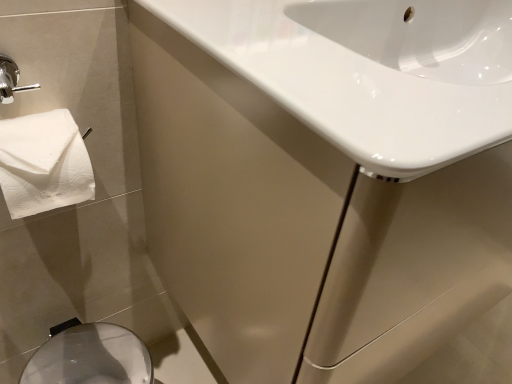
Question: Should I look upward or downward to see silver metallic bidet at lower left?

Choices:
 (A) up
 (B) down

Answer: (B)

Question: From the image's perspective, is white glossy sink at upper right above white glossy sink at upper right?

Choices:
 (A) yes
 (B) no

Answer: (B)

Question: From a real-world perspective, does white glossy sink at upper right stand above white glossy sink at upper right?

Choices:
 (A) yes
 (B) no

Answer: (B)

Question: Is white glossy sink at upper right a part of white glossy sink at upper right?

Choices:
 (A) yes
 (B) no

Answer: (A)

Question: Is white glossy sink at upper right oriented towards white glossy sink at upper right?

Choices:
 (A) no
 (B) yes

Answer: (A)

Question: Is white glossy sink at upper right with white glossy sink at upper right?

Choices:
 (A) no
 (B) yes

Answer: (A)

Question: Is white glossy sink at upper right completely or partially outside of white glossy sink at upper right?

Choices:
 (A) yes
 (B) no

Answer: (A)

Question: Does silver metallic bidet at lower left have a greater height compared to white glossy sink at upper right?

Choices:
 (A) yes
 (B) no

Answer: (A)

Question: From a real-world perspective, is silver metallic bidet at lower left physically above white glossy sink at upper right?

Choices:
 (A) yes
 (B) no

Answer: (B)

Question: Can you confirm if silver metallic bidet at lower left is thinner than white glossy sink at upper right?

Choices:
 (A) yes
 (B) no

Answer: (A)

Question: From the image's perspective, would you say silver metallic bidet at lower left is shown under white glossy sink at upper right?

Choices:
 (A) no
 (B) yes

Answer: (B)

Question: Is silver metallic bidet at lower left aimed at white glossy sink at upper right?

Choices:
 (A) yes
 (B) no

Answer: (B)

Question: Is silver metallic bidet at lower left shorter than white glossy sink at upper right?

Choices:
 (A) yes
 (B) no

Answer: (B)

Question: Could you tell me if white glossy sink at upper right is facing white glossy sink at upper right?

Choices:
 (A) yes
 (B) no

Answer: (A)